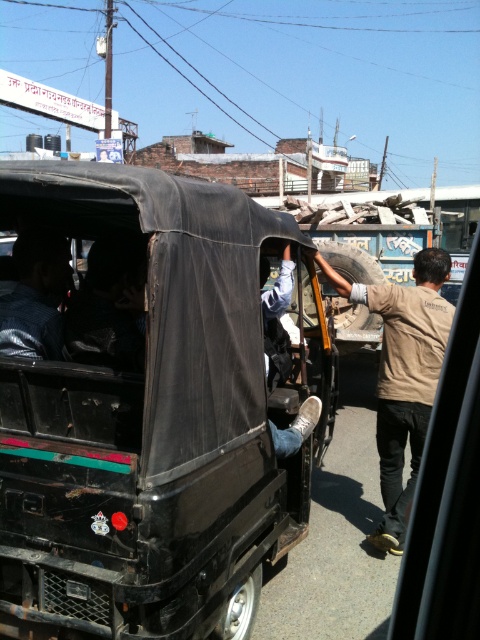
Question: Is black matte jeep at center to the right of dark blue shirt at rear left from the viewer's perspective?

Choices:
 (A) no
 (B) yes

Answer: (B)

Question: From the image, what is the correct spatial relationship of black matte jeep at center in relation to dark blue shirt at rear left?

Choices:
 (A) right
 (B) left

Answer: (A)

Question: Is black matte jeep at center closer to camera compared to dark blue shirt at rear left?

Choices:
 (A) no
 (B) yes

Answer: (B)

Question: Which point is farther from the camera taking this photo?

Choices:
 (A) (22, 282)
 (B) (224, 301)

Answer: (A)